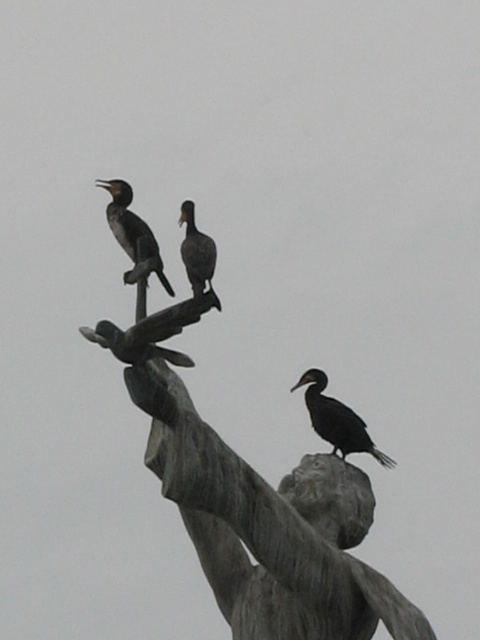
Is bronze statue at upper center positioned at the back of black matte bird at center?

No, bronze statue at upper center is closer to the viewer.

Can you confirm if bronze statue at upper center is shorter than black matte bird at center?

Incorrect, bronze statue at upper center's height does not fall short of black matte bird at center's.

This screenshot has width=480, height=640. I want to click on bronze statue at upper center, so click(x=249, y=490).

Does bronze statue at upper center have a greater height compared to dark gray feathers at upper center?

Yes, bronze statue at upper center is taller than dark gray feathers at upper center.

Between bronze statue at upper center and dark gray feathers at upper center, which one has less height?

With less height is dark gray feathers at upper center.

Locate an element on the screen. The width and height of the screenshot is (480, 640). bronze statue at upper center is located at coordinates (249, 490).

Does black matte bird at center have a lesser height compared to dark gray feathers at upper center?

Indeed, black matte bird at center has a lesser height compared to dark gray feathers at upper center.

Is point (356, 426) positioned after point (128, 241)?

Yes, it is behind point (128, 241).

The height and width of the screenshot is (640, 480). Describe the element at coordinates (336, 419) in the screenshot. I see `black matte bird at center` at that location.

This screenshot has width=480, height=640. I want to click on black matte bird at center, so click(x=336, y=419).